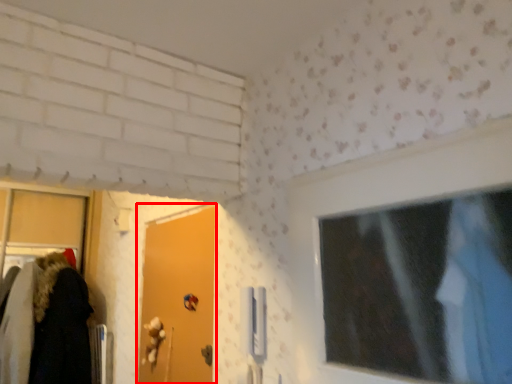
Question: Observing the image, what is the correct spatial positioning of door (annotated by the red box) in reference to door handle?

Choices:
 (A) left
 (B) right

Answer: (A)